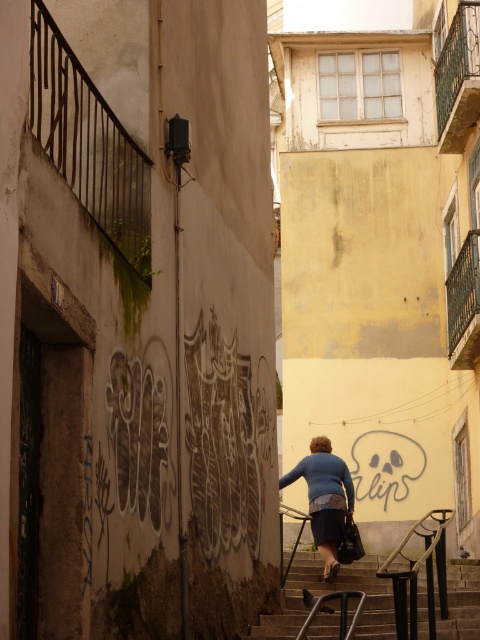
Question: Is stone textured stairs at center smaller than blue sweater at center?

Choices:
 (A) yes
 (B) no

Answer: (B)

Question: Is stone textured stairs at center in front of blue sweater at center?

Choices:
 (A) yes
 (B) no

Answer: (A)

Question: Which point is closer to the camera?

Choices:
 (A) (448, 582)
 (B) (340, 513)

Answer: (B)

Question: Which point is farther to the camera?

Choices:
 (A) click(x=336, y=481)
 (B) click(x=374, y=556)

Answer: (B)

Question: Is stone textured stairs at center above blue sweater at center?

Choices:
 (A) yes
 (B) no

Answer: (B)